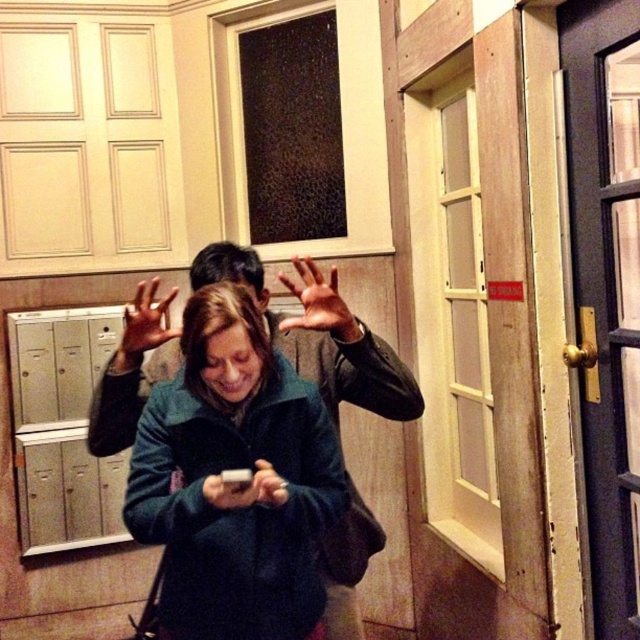
In the scene shown: You are trying to determine if the matte black hands at center can hold the matte black phone at center without overlapping. Based on their sizes, do you think this is possible?

The matte black hands at center are wider than the matte black phone at center, so yes, they can hold it without overlapping.